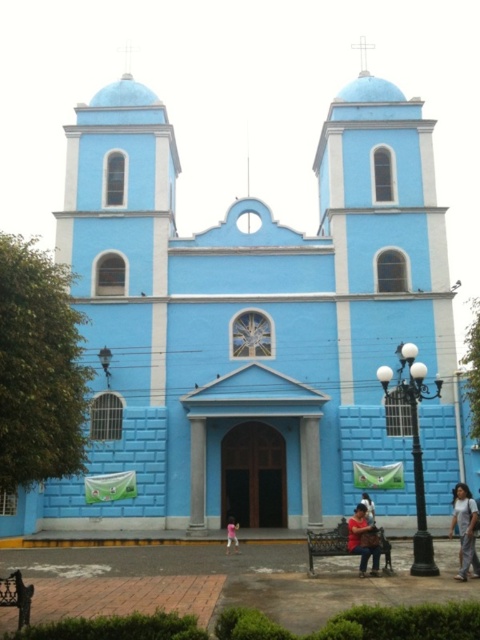
Does point (456, 496) come farther from viewer compared to point (373, 512)?

No, it is not.

Identify the location of denim pants at lower right. The image size is (480, 640). (465, 529).

Measure the distance from pink fabric at center to light brown leather jacket at lower center.

pink fabric at center is 32.67 feet away from light brown leather jacket at lower center.

Can you confirm if pink fabric at center is smaller than light brown leather jacket at lower center?

Correct, pink fabric at center occupies less space than light brown leather jacket at lower center.

What do you see at coordinates (231, 532) in the screenshot? The width and height of the screenshot is (480, 640). I see `pink fabric at center` at bounding box center [231, 532].

This screenshot has width=480, height=640. I want to click on pink fabric at center, so click(x=231, y=532).

Is denim pants at lower right positioned at the back of pink fabric at center?

No, denim pants at lower right is closer to the viewer.

Where is `denim pants at lower right`? Image resolution: width=480 pixels, height=640 pixels. denim pants at lower right is located at coordinates (465, 529).